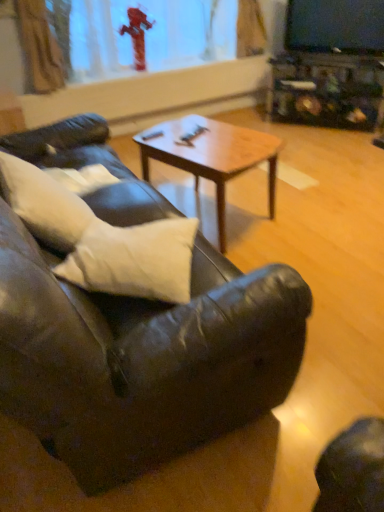
Question: Considering the positions of transparent glass fire hydrant at upper center and white matte pillow at left, acting as the second pillow starting from the right, in the image, is transparent glass fire hydrant at upper center wider or thinner than white matte pillow at left, acting as the second pillow starting from the right,?

Choices:
 (A) wide
 (B) thin

Answer: (B)

Question: Which is correct: transparent glass fire hydrant at upper center is inside white matte pillow at left, acting as the 1th pillow starting from the left, or outside of it?

Choices:
 (A) outside
 (B) inside

Answer: (A)

Question: Which object is positioned closest to the leather couch at center?

Choices:
 (A) black glossy tv at upper right
 (B) transparent glass fire hydrant at upper center
 (C) white matte pillow at left, acting as the 1th pillow starting from the left
 (D) white soft pillow at center, the second pillow in the left-to-right sequence
 (E) woodenmaterial/texturecoffee table at center

Answer: (D)

Question: Which is nearer to the white matte pillow at left, acting as the second pillow starting from the right?

Choices:
 (A) black glossy tv at upper right
 (B) leather couch at center
 (C) white soft pillow at center, which is counted as the first pillow, starting from the right
 (D) woodenmaterial/texturecoffee table at center
 (E) transparent glass fire hydrant at upper center

Answer: (C)